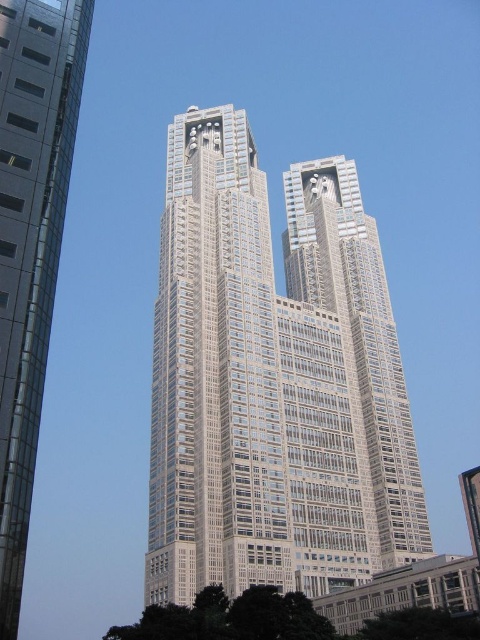
Question: Can you confirm if white glass building at center is wider than silver glass skyscraper at center?

Choices:
 (A) no
 (B) yes

Answer: (B)

Question: Which point is farther to the camera?

Choices:
 (A) silver glass skyscraper at center
 (B) white glass building at center

Answer: (B)

Question: Can you confirm if white glass building at center is thinner than silver glass skyscraper at center?

Choices:
 (A) no
 (B) yes

Answer: (A)

Question: Which of the following is the farthest from the observer?

Choices:
 (A) (248, 392)
 (B) (20, 573)

Answer: (A)

Question: Is white glass building at center thinner than silver glass skyscraper at center?

Choices:
 (A) no
 (B) yes

Answer: (A)